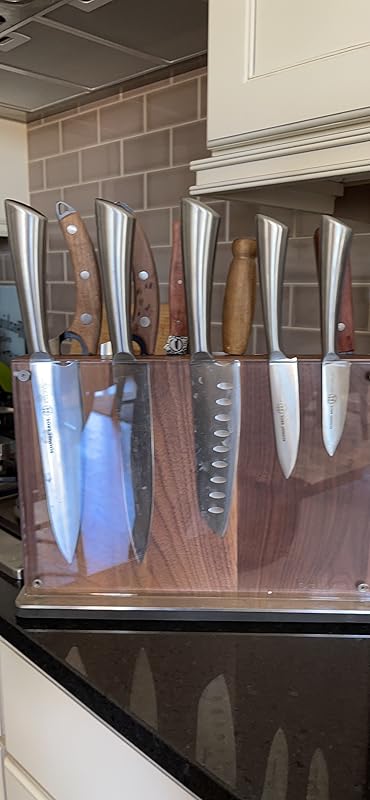
At what (x,y) coordinates should I click in order to perform the action: click on white drawer. Please return your answer as a coordinate pair (x, y). Looking at the image, I should click on (71, 748).